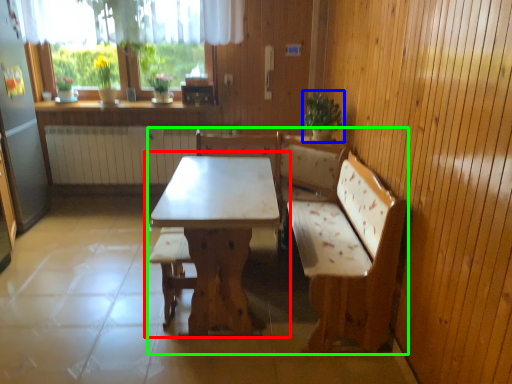
Question: Which is nearer to the table (highlighted by a red box)? houseplant (highlighted by a blue box) or furniture (highlighted by a green box).

Choices:
 (A) houseplant
 (B) furniture

Answer: (B)